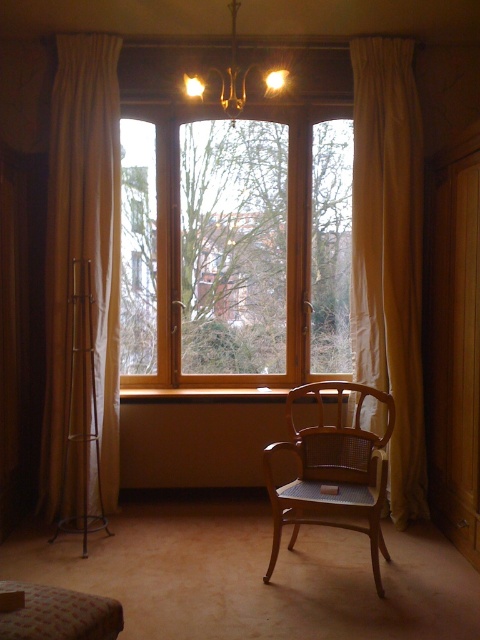
Question: Among these objects, which one is nearest to the camera?

Choices:
 (A) matte gold chandelier at upper center
 (B) wooden bay window at center
 (C) wooden cane chair at center
 (D) beige fabric curtain at left

Answer: (C)

Question: Estimate the real-world distances between objects in this image. Which object is farther from the beige fabric curtain at left?

Choices:
 (A) beige fabric curtain at right
 (B) wooden bay window at center

Answer: (A)

Question: Can you confirm if wooden bay window at center is smaller than beige fabric curtain at right?

Choices:
 (A) no
 (B) yes

Answer: (A)

Question: Is beige fabric curtain at left positioned behind wooden cane chair at center?

Choices:
 (A) no
 (B) yes

Answer: (B)

Question: Which point is closer to the camera?

Choices:
 (A) (228, 8)
 (B) (420, 154)
 (C) (331, 260)

Answer: (A)

Question: Does wooden bay window at center appear on the right side of matte gold chandelier at upper center?

Choices:
 (A) no
 (B) yes

Answer: (A)